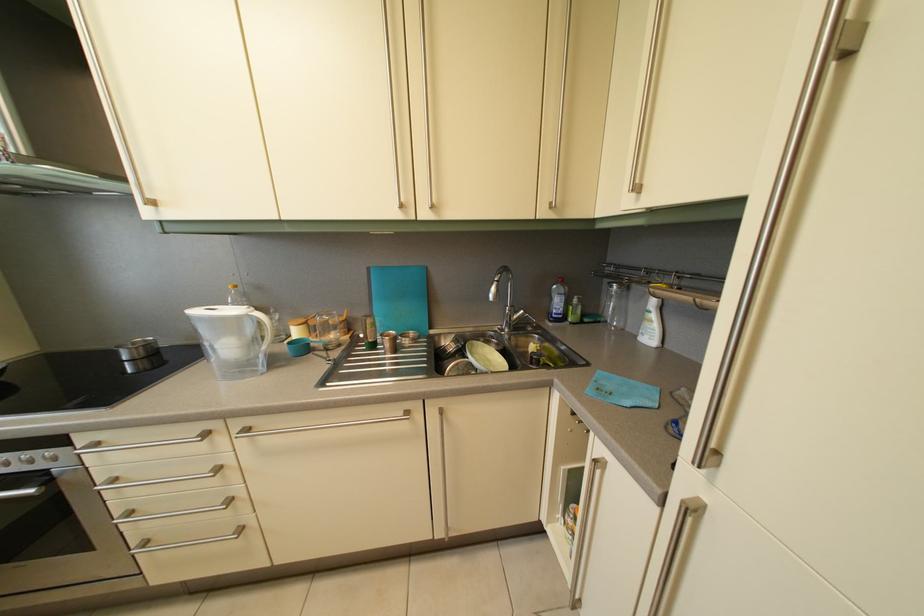
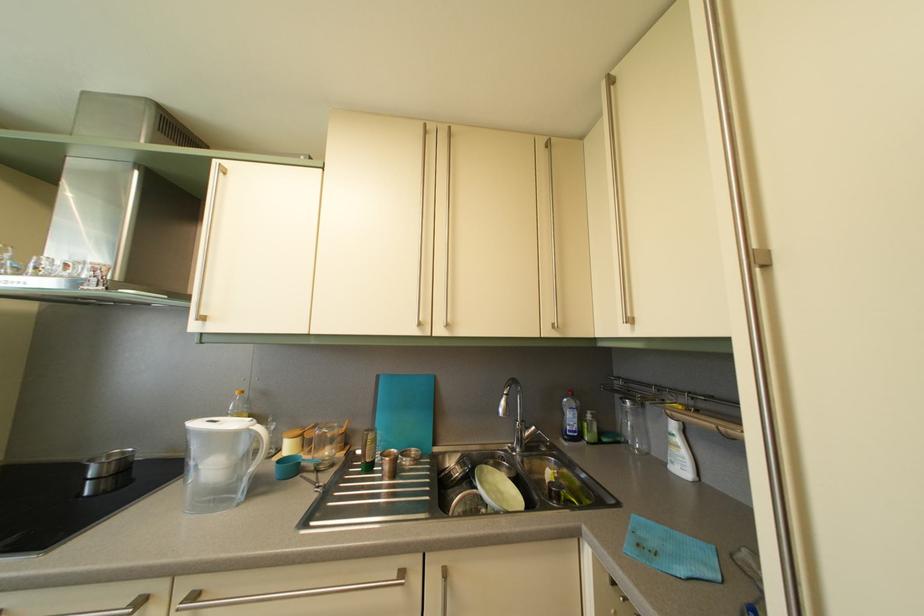
Locate, in the second image, the point that corresponds to (x=266, y=322) in the first image.

(266, 436)